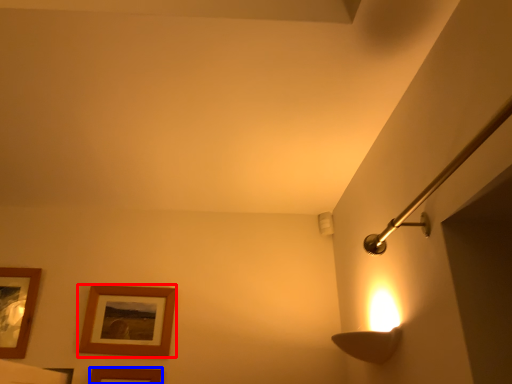
Question: Which object is further to the camera taking this photo, picture frame (highlighted by a red box) or picture frame (highlighted by a blue box)?

Choices:
 (A) picture frame
 (B) picture frame

Answer: (A)